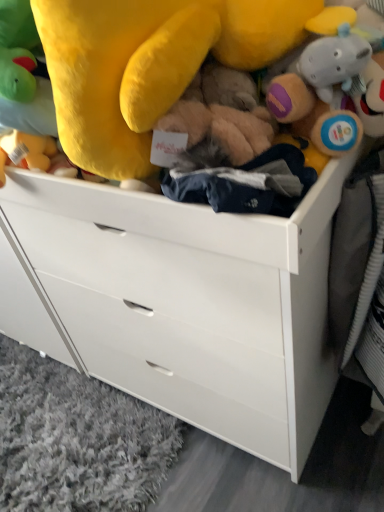
What do you see at coordinates (154, 63) in the screenshot? I see `soft plush toys at upper center` at bounding box center [154, 63].

Find the location of a particular element. This screenshot has height=512, width=384. soft plush toys at upper center is located at coordinates (154, 63).

Where is `white matte chest of drawers at center`? This screenshot has height=512, width=384. white matte chest of drawers at center is located at coordinates (180, 302).

Measure the distance between point (303, 428) and camera.

Point (303, 428) and camera are 3.74 feet apart from each other.

The width and height of the screenshot is (384, 512). What do you see at coordinates (180, 302) in the screenshot? I see `white matte chest of drawers at center` at bounding box center [180, 302].

This screenshot has height=512, width=384. I want to click on soft plush toys at upper center, so click(154, 63).

Would you say soft plush toys at upper center is to the left or to the right of white matte chest of drawers at center in the picture?

soft plush toys at upper center is positioned on white matte chest of drawers at center's left side.

Consider the image. Which is behind, soft plush toys at upper center or white matte chest of drawers at center?

white matte chest of drawers at center is behind.

Is point (91, 146) positioned before point (234, 442)?

Yes.

From the image's perspective, is soft plush toys at upper center beneath white matte chest of drawers at center?

No, from the image's perspective, soft plush toys at upper center is not beneath white matte chest of drawers at center.

From a real-world perspective, is soft plush toys at upper center under white matte chest of drawers at center?

No, from a real-world perspective, soft plush toys at upper center is not under white matte chest of drawers at center.

Is soft plush toys at upper center wider or thinner than white matte chest of drawers at center?

Considering their sizes, soft plush toys at upper center looks slimmer than white matte chest of drawers at center.

Considering the sizes of objects soft plush toys at upper center and white matte chest of drawers at center in the image provided, who is shorter, soft plush toys at upper center or white matte chest of drawers at center?

With less height is soft plush toys at upper center.

Considering the sizes of objects soft plush toys at upper center and white matte chest of drawers at center in the image provided, who is bigger, soft plush toys at upper center or white matte chest of drawers at center?

Bigger between the two is white matte chest of drawers at center.

Is soft plush toys at upper center positioned beyond the bounds of white matte chest of drawers at center?

Indeed, soft plush toys at upper center is completely outside white matte chest of drawers at center.

From the picture: Does soft plush toys at upper center touch white matte chest of drawers at center?

They are not placed beside each other.

Looking at this image, is white matte chest of drawers at center at the back of soft plush toys at upper center?

No, soft plush toys at upper center is not facing away from white matte chest of drawers at center.

You are a GUI agent. You are given a task and a screenshot of the screen. Output one action in this format:
    pyautogui.click(x=<x>, y=<y>)
    Task: Click on the toy in front of the white matte chest of drawers at center
    
    Given the screenshot: What is the action you would take?
    pyautogui.click(x=154, y=63)

Which object is positioned more to the left, white matte chest of drawers at center or soft plush toys at upper center?

Positioned to the left is soft plush toys at upper center.

Relative to soft plush toys at upper center, is white matte chest of drawers at center in front or behind?

Visually, white matte chest of drawers at center is located behind soft plush toys at upper center.

Is point (167, 251) farther from camera compared to point (70, 57)?

Yes, point (167, 251) is farther from viewer.

From the image's perspective, does white matte chest of drawers at center appear higher than soft plush toys at upper center?

Incorrect, from the image's perspective, white matte chest of drawers at center is lower than soft plush toys at upper center.

Consider the image. From a real-world perspective, is white matte chest of drawers at center located higher than soft plush toys at upper center?

No, from a real-world perspective, white matte chest of drawers at center is not above soft plush toys at upper center.

Does white matte chest of drawers at center have a lesser width compared to soft plush toys at upper center?

In fact, white matte chest of drawers at center might be wider than soft plush toys at upper center.

Considering the sizes of objects white matte chest of drawers at center and soft plush toys at upper center in the image provided, who is taller, white matte chest of drawers at center or soft plush toys at upper center?

white matte chest of drawers at center.

Which of these two, white matte chest of drawers at center or soft plush toys at upper center, is smaller?

soft plush toys at upper center.

Would you say white matte chest of drawers at center is outside soft plush toys at upper center?

That's correct, white matte chest of drawers at center is outside of soft plush toys at upper center.

Are white matte chest of drawers at center and soft plush toys at upper center located far from each other?

That's not correct — white matte chest of drawers at center is a little close to soft plush toys at upper center.

Is white matte chest of drawers at center aimed at soft plush toys at upper center?

No.

Can you tell me how much white matte chest of drawers at center and soft plush toys at upper center differ in facing direction?

0.000278 degrees.

How distant is white matte chest of drawers at center from soft plush toys at upper center?

white matte chest of drawers at center and soft plush toys at upper center are 14.51 inches apart.

You are a GUI agent. You are given a task and a screenshot of the screen. Output one action in this format:
    pyautogui.click(x=<x>, y=<y>)
    Task: Click on the toy located in front of the white matte chest of drawers at center
    
    Given the screenshot: What is the action you would take?
    pyautogui.click(x=154, y=63)

Identify the location of chest of drawers below the soft plush toys at upper center (from the image's perspective). (180, 302).

Image resolution: width=384 pixels, height=512 pixels. I want to click on chest of drawers to the right of soft plush toys at upper center, so click(x=180, y=302).